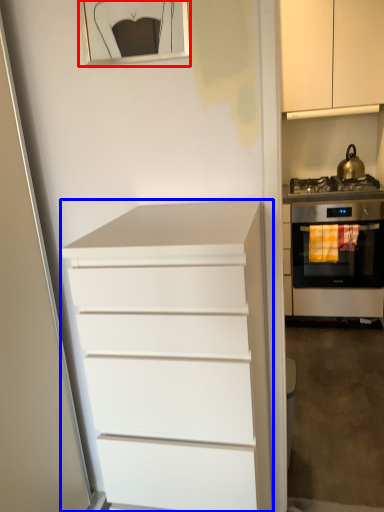
Question: Which point is closer to the camera, picture frame (highlighted by a red box) or chest of drawers (highlighted by a blue box)?

Choices:
 (A) picture frame
 (B) chest of drawers

Answer: (B)